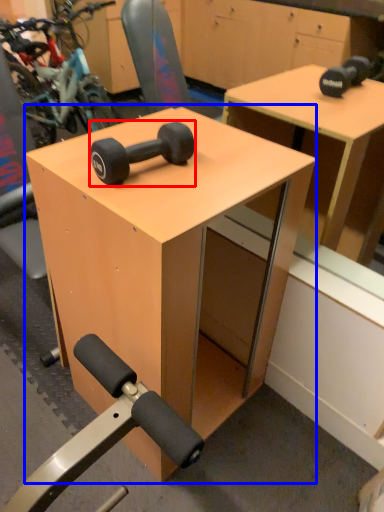
Question: Which of the following is the farthest to the observer, dumbbell (highlighted by a red box) or table (highlighted by a blue box)?

Choices:
 (A) dumbbell
 (B) table

Answer: (A)